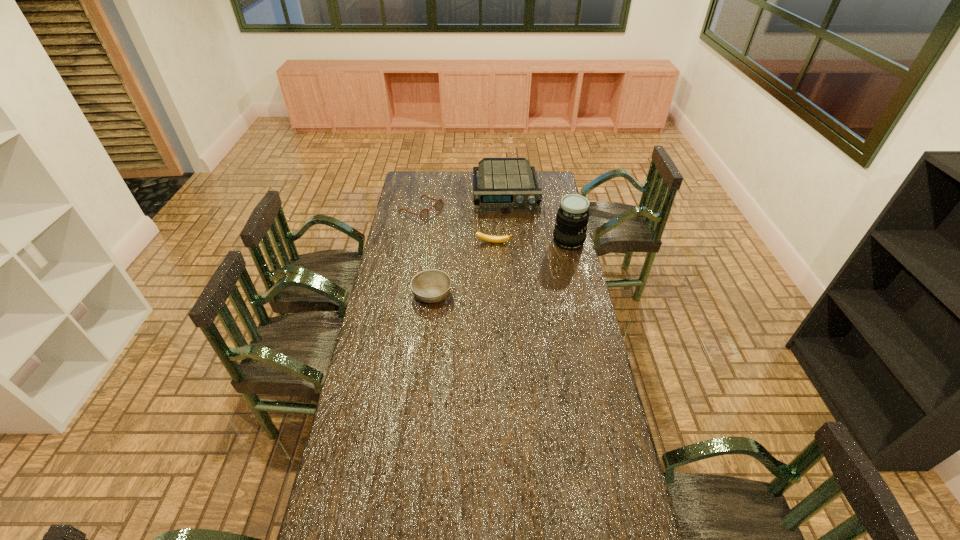
The width and height of the screenshot is (960, 540). I want to click on vacant area in the image that satisfies the following two spatial constraints: 1. on the back side of the radio receiver; 2. on the right side of the banana, so click(x=492, y=193).